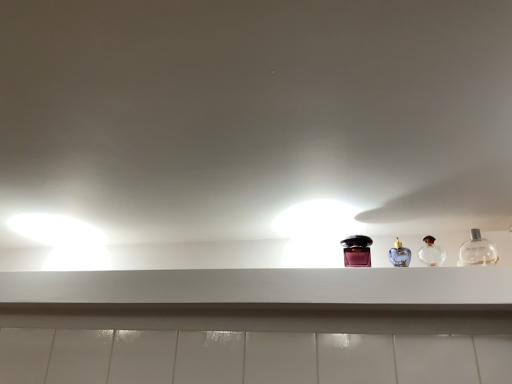
Question: Do you think clear glass bottle at right, which is the 1th bottle in right-to-left order, is within clear glass perfume at center right, the second bottle viewed from the right, or outside of it?

Choices:
 (A) inside
 (B) outside

Answer: (B)

Question: From a real-world perspective, relative to clear glass perfume at center right, placed as the 2th bottle when sorted from left to right, is clear glass bottle at right, which is the 1th bottle in right-to-left order, vertically above or below?

Choices:
 (A) above
 (B) below

Answer: (B)

Question: Estimate the real-world distances between objects in this image. Which object is closer to the clear glass bottle at right, which is the 1th bottle in right-to-left order?

Choices:
 (A) white matte shelf at center
 (B) shiny purple bottle at center, positioned as the third bottle in right-to-left order
 (C) clear glass perfume at center right, the second bottle viewed from the right

Answer: (C)

Question: Based on their relative distances, which object is nearer to the clear glass bottle at right, which is the 1th bottle in right-to-left order?

Choices:
 (A) white matte shelf at center
 (B) clear glass perfume at center right, placed as the 2th bottle when sorted from left to right
 (C) shiny purple bottle at center, positioned as the 1th bottle in left-to-right order

Answer: (B)